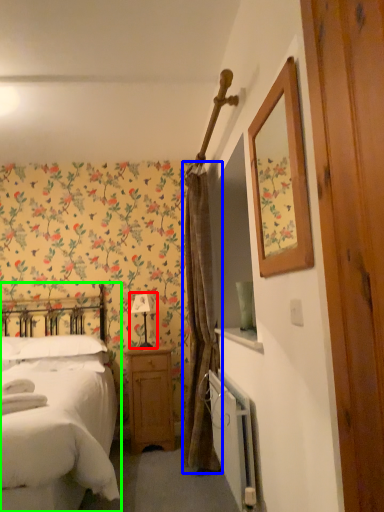
Question: Which is nearer to the table lamp (highlighted by a red box)? curtain (highlighted by a blue box) or bed (highlighted by a green box).

Choices:
 (A) curtain
 (B) bed

Answer: (A)